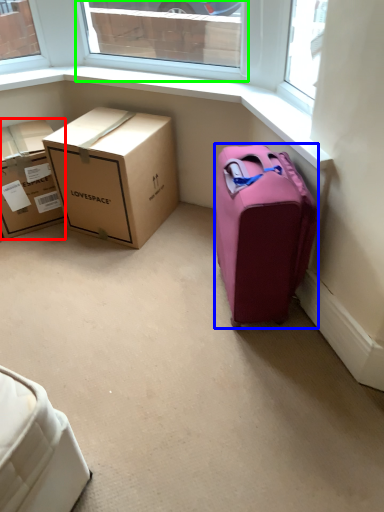
Question: Which object is positioned farthest from box (highlighted by a red box)? Select from suitcase (highlighted by a blue box) and window (highlighted by a green box).

Choices:
 (A) suitcase
 (B) window

Answer: (B)